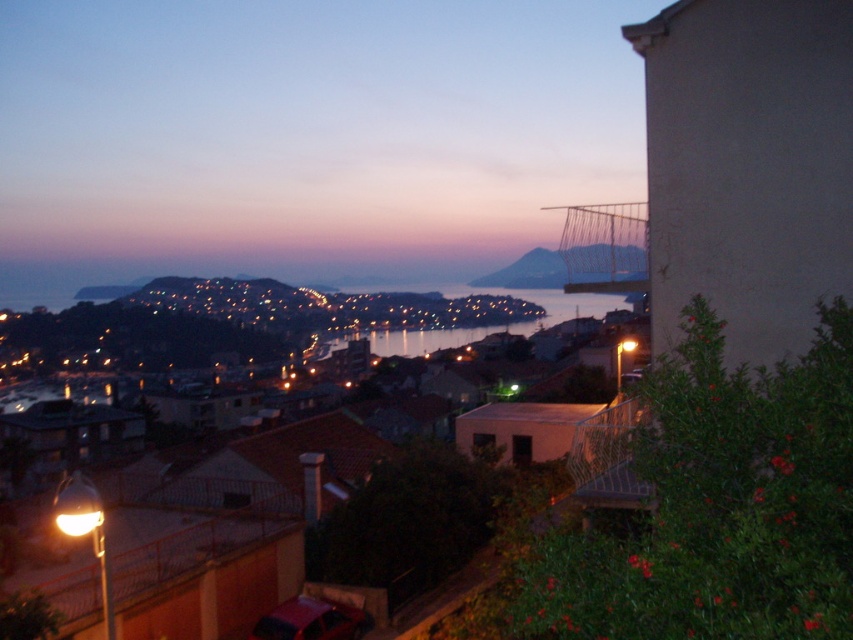
Question: Can you confirm if metallic wire mesh at upper right is bigger than metallic silver balcony at lower right?

Choices:
 (A) no
 (B) yes

Answer: (B)

Question: Which of these objects is positioned farthest from the matte concrete balcony at upper right?

Choices:
 (A) glistening water at center
 (B) metallic silver balcony at lower right
 (C) metallic wire mesh at upper right

Answer: (B)

Question: Does metallic wire mesh at upper right appear over matte gray hillside at center?

Choices:
 (A) yes
 (B) no

Answer: (A)

Question: Is matte concrete balcony at upper right to the left of glistening water at center from the viewer's perspective?

Choices:
 (A) no
 (B) yes

Answer: (B)

Question: Which object is positioned closest to the metallic silver balcony at lower right?

Choices:
 (A) glistening water at center
 (B) matte concrete balcony at upper right

Answer: (A)

Question: Which object is the closest to the matte gray hillside at center?

Choices:
 (A) glistening water at center
 (B) metallic wire mesh at upper right
 (C) matte concrete balcony at upper right
 (D) metallic silver balcony at lower right

Answer: (B)